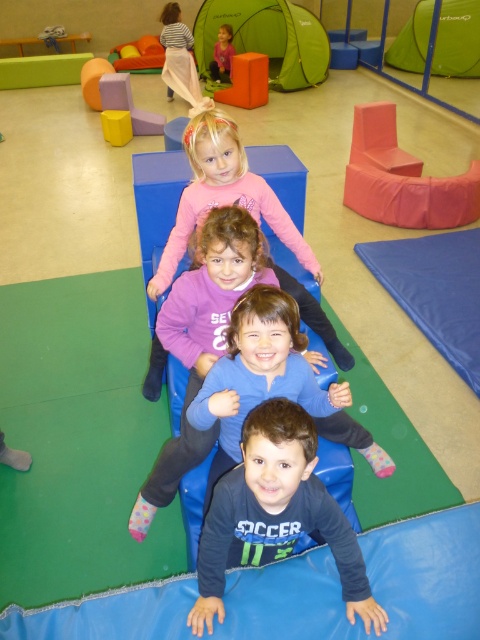
Question: Is blue cotton shirt at center wider than pink fleece sweater at upper center?

Choices:
 (A) no
 (B) yes

Answer: (B)

Question: Is dark blue jersey at center positioned behind pink fleece sweater at upper center?

Choices:
 (A) no
 (B) yes

Answer: (A)

Question: Which point is closer to the camera?

Choices:
 (A) (230, 184)
 (B) (286, 404)
 (C) (233, 280)

Answer: (B)

Question: Based on their relative distances, which object is farther from the pink fleece sweater at upper center?

Choices:
 (A) dark blue jersey at center
 (B) pink fleece sweater at center

Answer: (A)

Question: Which point is farther to the camera?

Choices:
 (A) (289, 291)
 (B) (242, 276)
 (C) (218, 61)
 (D) (249, 492)

Answer: (C)

Question: Can you confirm if dark blue jersey at center is positioned to the right of pink fleece sweater at upper center?

Choices:
 (A) no
 (B) yes

Answer: (B)